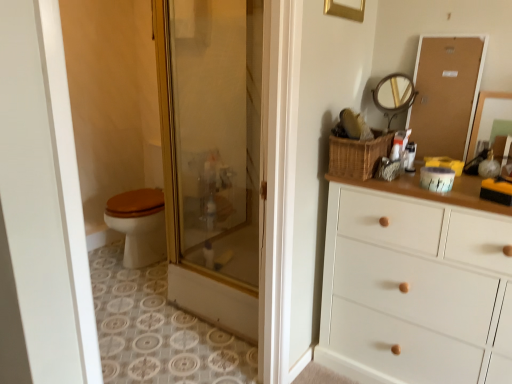
Question: Do you think woven brown basket at upper right is within corkboard at upper right, or outside of it?

Choices:
 (A) inside
 (B) outside

Answer: (B)

Question: From the image's perspective, relative to corkboard at upper right, is woven brown basket at upper right above or below?

Choices:
 (A) above
 (B) below

Answer: (B)

Question: Estimate the real-world distances between objects in this image. Which object is farther from the matte wooden mirror at upper right, which is the second mirror from left to right?

Choices:
 (A) white painted wood chest of drawers at right
 (B) corkboard at upper right
 (C) woven brown basket at upper right
 (D) gold-toned metal mirror at upper right, which ranks as the first mirror in left-to-right order

Answer: (A)

Question: Estimate the real-world distances between objects in this image. Which object is closer to the matte wooden mirror at upper right, which is the second mirror from left to right?

Choices:
 (A) gold-toned metal mirror at upper right, which ranks as the 2th mirror in right-to-left order
 (B) corkboard at upper right
 (C) white painted wood chest of drawers at right
 (D) woven brown basket at upper right

Answer: (B)